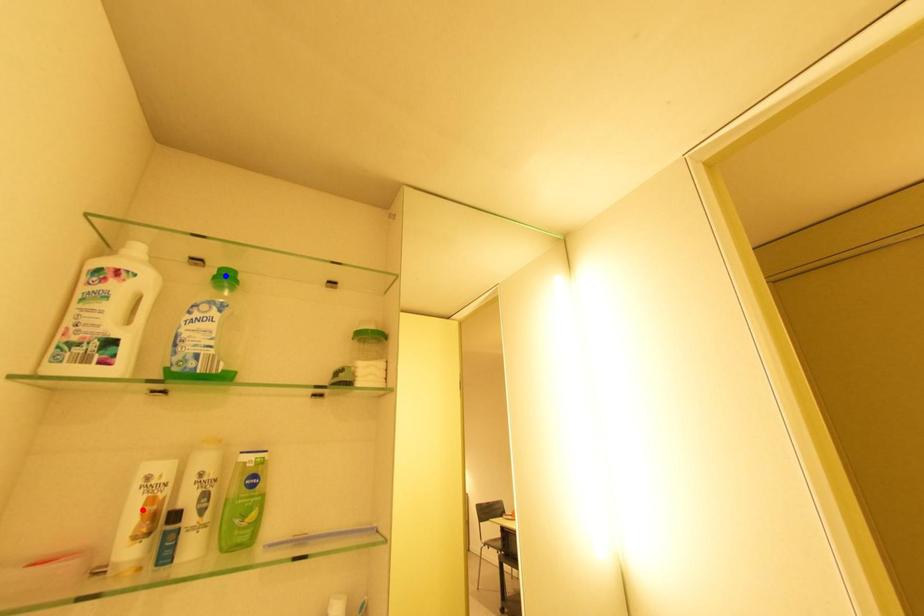
Question: Which of the two points in the image is closer to the camera?

Choices:
 (A) Blue point is closer.
 (B) Red point is closer.

Answer: (B)